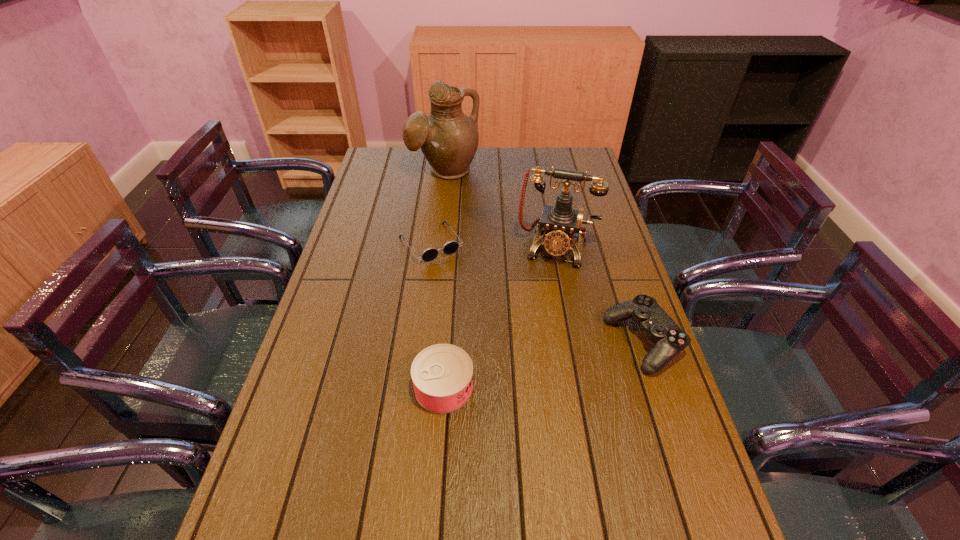
Find the location of `blank space at the near edge of the desktop`. blank space at the near edge of the desktop is located at coordinates (545, 488).

The height and width of the screenshot is (540, 960). What are the coordinates of `vacant area at the left edge of the desktop` in the screenshot? It's located at coord(361,276).

The image size is (960, 540). I want to click on free spot at the far left corner of the desktop, so click(x=400, y=174).

Image resolution: width=960 pixels, height=540 pixels. I want to click on free space at the far right corner, so 575,167.

Find the location of `vacant point located between the control and the can`. vacant point located between the control and the can is located at coordinates [x=543, y=365].

At what (x,y) coordinates should I click in order to perform the action: click on free space that is in between the second tallest object and the control. Please return your answer as a coordinate pair (x, y). Image resolution: width=960 pixels, height=540 pixels. Looking at the image, I should click on (600, 295).

You are a GUI agent. You are given a task and a screenshot of the screen. Output one action in this format:
    pyautogui.click(x=<x>, y=<y>)
    Task: Click on the free point between the can and the fourth shortest object
    The height and width of the screenshot is (540, 960).
    Given the screenshot: What is the action you would take?
    pyautogui.click(x=500, y=318)

Identify the location of free spot between the control and the second tallest object. This screenshot has width=960, height=540. (600, 295).

What are the coordinates of `vacant space in between the shortest object and the telephone` in the screenshot? It's located at (493, 246).

The height and width of the screenshot is (540, 960). I want to click on unoccupied position between the farthest object and the can, so click(444, 280).